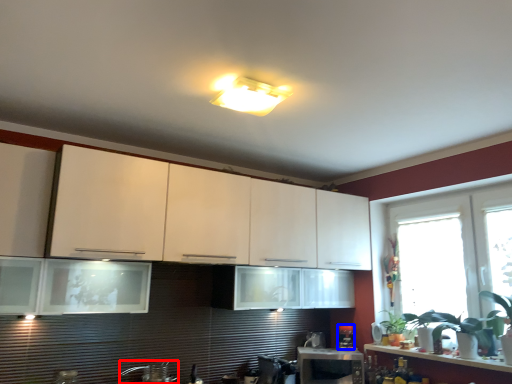
Question: Which object is further to the camera taking this photo, faucet (highlighted by a red box) or appliance (highlighted by a blue box)?

Choices:
 (A) faucet
 (B) appliance

Answer: (B)